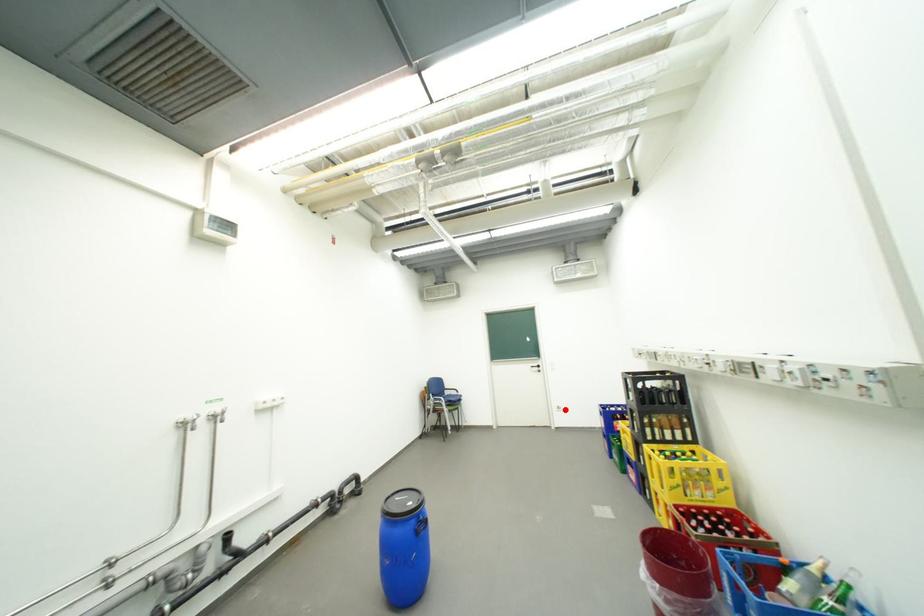
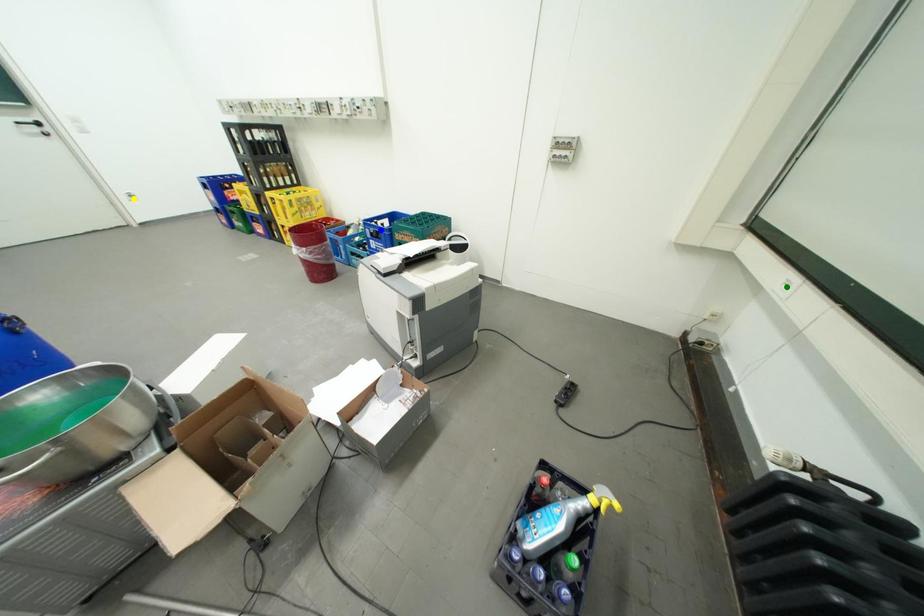
Question: I am providing you with two images of the same scene from different viewpoints. A red point is marked on the first image. You are given multiple points on the second image. In image 2, which mark is for the same physical point as the one in image 1?

Choices:
 (A) yellow point
 (B) blue point
 (C) green point

Answer: (A)